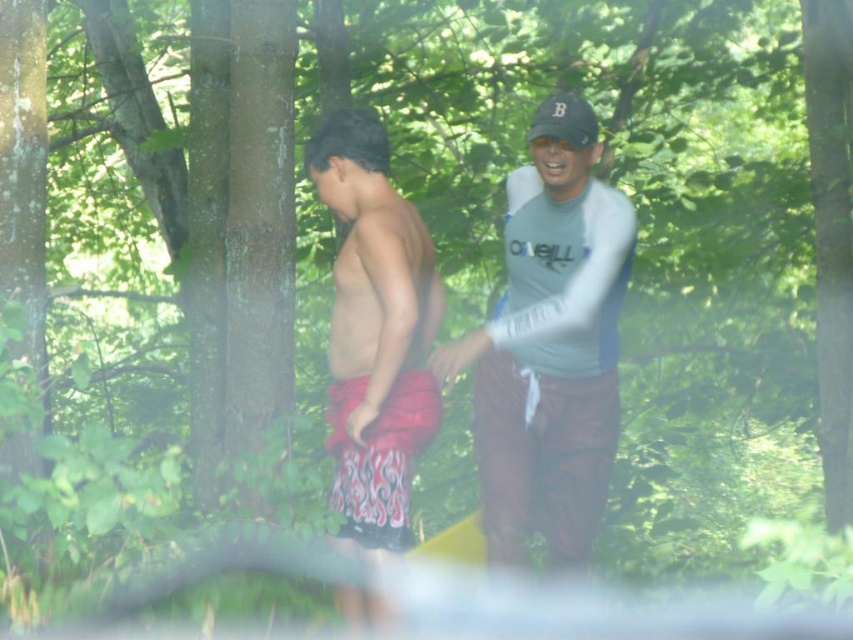
Who is taller, reddish-patterned shorts at center or black fabric baseball cap at upper right?

Standing taller between the two is reddish-patterned shorts at center.

Does point (368, 212) come behind point (550, 122)?

Yes, point (368, 212) is behind point (550, 122).

Find the location of a particular element. This screenshot has width=853, height=640. reddish-patterned shorts at center is located at coordinates (375, 330).

Can you confirm if printed fabric shorts at center is bigger than black fabric baseball cap at upper right?

Correct, printed fabric shorts at center is larger in size than black fabric baseball cap at upper right.

Can you confirm if printed fabric shorts at center is positioned to the left of black fabric baseball cap at upper right?

Correct, you'll find printed fabric shorts at center to the left of black fabric baseball cap at upper right.

Where is `printed fabric shorts at center`? printed fabric shorts at center is located at coordinates (379, 456).

Based on the photo, does reddish-patterned shorts at center have a larger size compared to printed fabric shorts at center?

Yes, reddish-patterned shorts at center is bigger than printed fabric shorts at center.

Describe the element at coordinates (375, 330) in the screenshot. This screenshot has height=640, width=853. I see `reddish-patterned shorts at center` at that location.

This screenshot has height=640, width=853. What are the coordinates of `reddish-patterned shorts at center` in the screenshot? It's located at (375, 330).